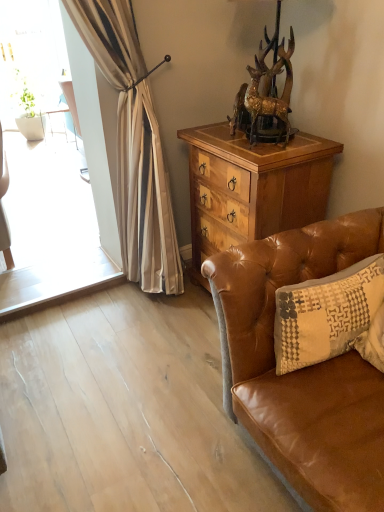
Question: Can you confirm if gold metallic deer at upper center is positioned to the right of brown leather couch at lower right?

Choices:
 (A) no
 (B) yes

Answer: (A)

Question: Can you confirm if gold metallic deer at upper center is taller than brown leather couch at lower right?

Choices:
 (A) yes
 (B) no

Answer: (B)

Question: Does gold metallic deer at upper center have a larger size compared to brown leather couch at lower right?

Choices:
 (A) no
 (B) yes

Answer: (A)

Question: Is brown leather couch at lower right at the back of gold metallic deer at upper center?

Choices:
 (A) yes
 (B) no

Answer: (B)

Question: Is gold metallic deer at upper center located outside brown leather couch at lower right?

Choices:
 (A) no
 (B) yes

Answer: (B)

Question: Relative to beige textured pillow at right, is brown leather couch at lower right in front or behind?

Choices:
 (A) behind
 (B) front

Answer: (B)

Question: From their relative heights in the image, would you say brown leather couch at lower right is taller or shorter than beige textured pillow at right?

Choices:
 (A) tall
 (B) short

Answer: (A)

Question: From the image's perspective, relative to beige textured pillow at right, is brown leather couch at lower right above or below?

Choices:
 (A) below
 (B) above

Answer: (A)

Question: From a real-world perspective, is brown leather couch at lower right positioned above or below beige textured pillow at right?

Choices:
 (A) above
 (B) below

Answer: (B)

Question: Would you say beige textured pillow at right is to the left or to the right of gold metallic deer at upper center in the picture?

Choices:
 (A) right
 (B) left

Answer: (A)

Question: Looking at the image, does beige textured pillow at right seem bigger or smaller compared to gold metallic deer at upper center?

Choices:
 (A) big
 (B) small

Answer: (A)

Question: Relative to gold metallic deer at upper center, is beige textured pillow at right in front or behind?

Choices:
 (A) front
 (B) behind

Answer: (A)

Question: Is beige textured pillow at right inside or outside of gold metallic deer at upper center?

Choices:
 (A) outside
 (B) inside

Answer: (A)

Question: Is wooden cabinet at center spatially inside beige textured pillow at right, or outside of it?

Choices:
 (A) outside
 (B) inside

Answer: (A)

Question: Relative to beige textured pillow at right, is wooden cabinet at center in front or behind?

Choices:
 (A) front
 (B) behind

Answer: (B)